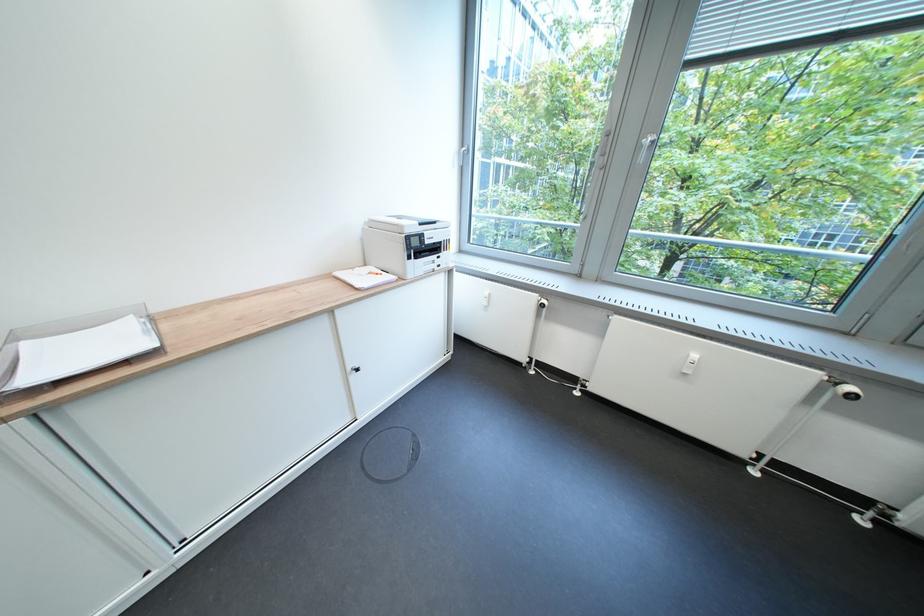
Find where to pull the cabinet door handle. Please return your answer as a coordinate pair (x, y).

(355, 369)